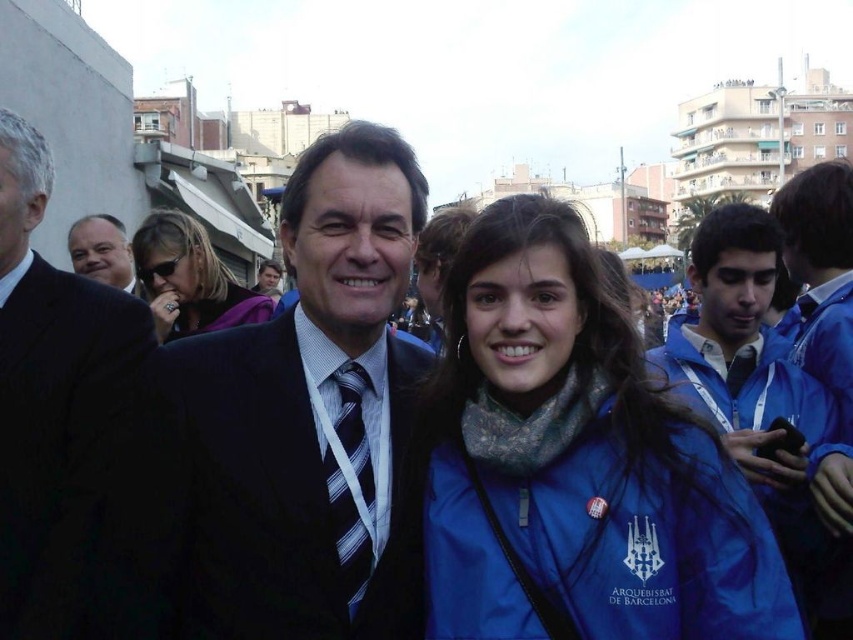
You are a photographer adjusting your camera settings to capture the scene. The matte black sunglasses at upper left and the matte black suit at left are both in focus. Which object would require a wider aperture setting to ensure proper focus on the subject?

The matte black sunglasses at upper left would require a wider aperture setting because its width is larger than the matte black suit at left, necessitating a larger opening to capture sufficient light for focus.

You are a photographer at the event and want to capture a photo that includes both the matte black sunglasses at upper left and the matte black suit at left. Which object should you adjust your camera to focus on first to ensure both are in frame?

The matte black sunglasses at upper left is to the right of the matte black suit at left, so you should focus on the matte black suit at left first to ensure both are in frame.

You are a photographer preparing to take a closeup shot of the matte black sunglasses at upper left and the matte black suit at left. Which object should you focus on first if you want to capture both clearly in the same frame?

The matte black sunglasses at upper left should be focused on first because it has a larger size compared to the matte black suit at left, so focusing on the larger object first ensures both are in focus within the depth of field.